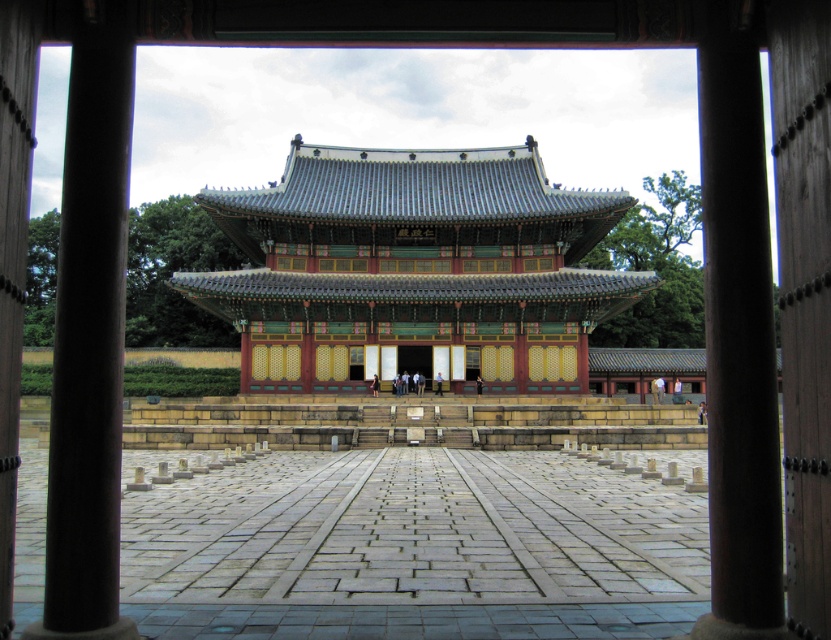
You are a tourist standing in front of the traditional Korean palace. You notice two pillars in the courtyard. The pillars are labeled as brown polished wood pillar at left and brown wood pillar at right. Which pillar is smaller in size?

The brown polished wood pillar at left is smaller than the brown wood pillar at right according to the description.

You are standing in the courtyard of the palace and want to take a photo of both pillars. Which pillar should you move toward to ensure both the brown polished wood pillar at left and the brown wood pillar at right are in frame?

You should move toward the brown polished wood pillar at left because it is closer to you, allowing both pillars to remain in the frame while adjusting your position accordingly.